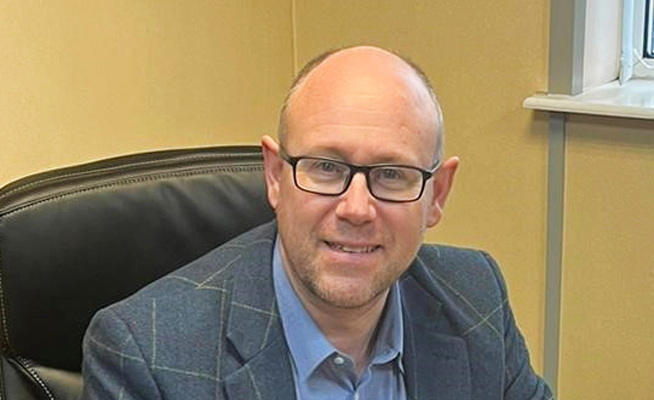
I want to click on yellow background wall, so click(x=39, y=88), click(x=191, y=55), click(x=519, y=193), click(x=609, y=246), click(x=471, y=60).